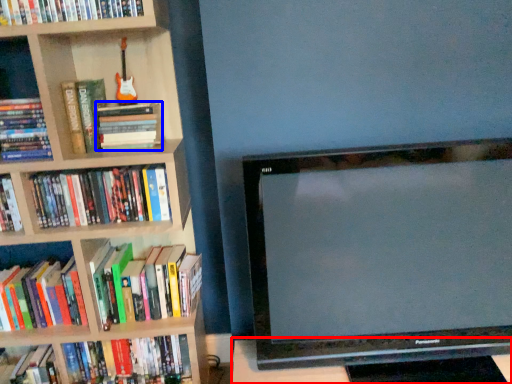
Question: Which point is further to the camera, table (highlighted by a red box) or book (highlighted by a blue box)?

Choices:
 (A) table
 (B) book

Answer: (B)